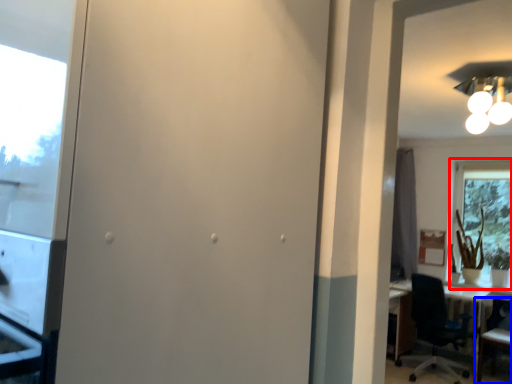
Question: Which of the following is the closest to the observer, window (highlighted by a red box) or chair (highlighted by a blue box)?

Choices:
 (A) window
 (B) chair

Answer: (B)